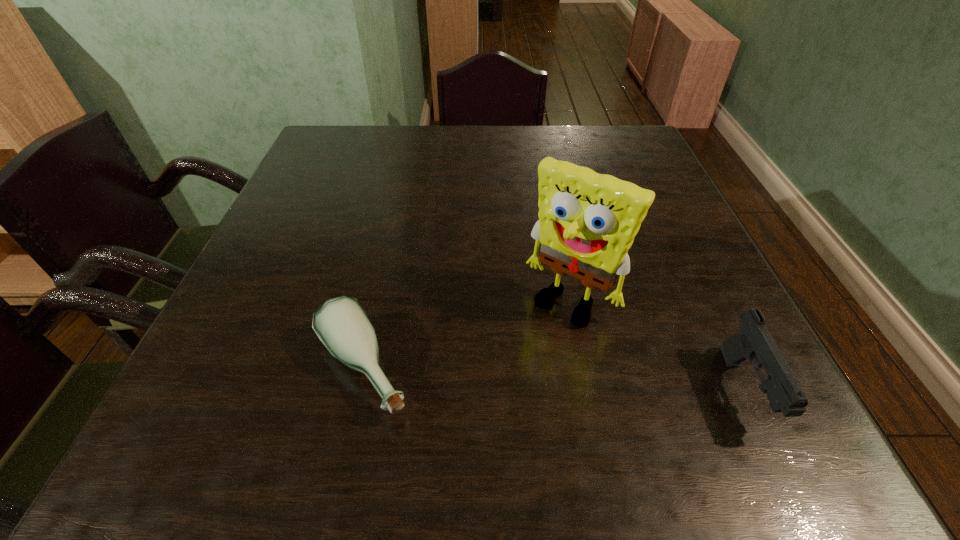
Locate an element on the screen. Image resolution: width=960 pixels, height=540 pixels. empty location between the tallest object and the rightmost object is located at coordinates (657, 346).

You are a GUI agent. You are given a task and a screenshot of the screen. Output one action in this format:
    pyautogui.click(x=<x>, y=<y>)
    Task: Click on the vacant area that lies between the second shortest object and the bottle
    
    Given the screenshot: What is the action you would take?
    pos(553,380)

Identify the location of unoccupied area between the second object from left to right and the bottle. Image resolution: width=960 pixels, height=540 pixels. (466, 335).

Where is `object that stands as the second closest to the shortest object`? Image resolution: width=960 pixels, height=540 pixels. object that stands as the second closest to the shortest object is located at coordinates (754, 343).

Locate which object ranks second in proximity to the tallest object. Please provide its 2D coordinates. Your answer should be formatted as a tuple, i.e. [(x, y)], where the tuple contains the x and y coordinates of a point satisfying the conditions above.

[(342, 325)]